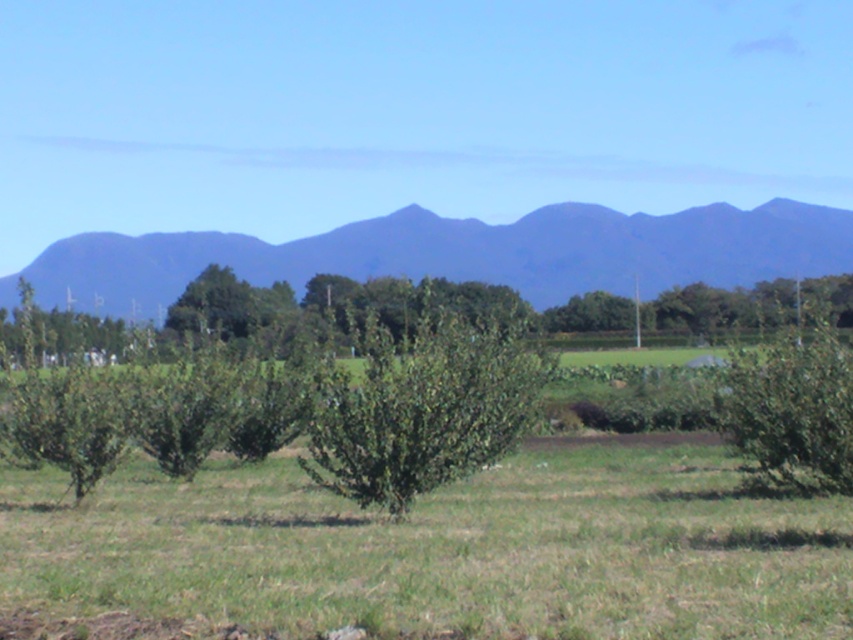
Looking at this image, you are standing in the middle of the rural landscape and want to take a photo of the blue matte mountain at upper center. According to the scene description, where should you position the camera to capture the mountain in the frame?

The blue matte mountain at upper center is located at point coordinates of (466, 253), so you should position the camera at the middle of the rural landscape to capture the mountain in the frame.

You are a landscape architect designing a new garden. You have to place a large sculpture between the blue matte mountain at upper center and the green leafy bush at center. Which object should the sculpture be closer to if it needs to be proportionally balanced with the existing elements?

The sculpture should be closer to the blue matte mountain at upper center because it is larger in size than the green leafy bush at center, so balancing the sculpture near the larger object maintains visual harmony.

You are standing at the point labeled point (x=466, y=253) in the image. What object is directly in front of you?

The blue matte mountain at upper center is directly in front of you at point (x=466, y=253).